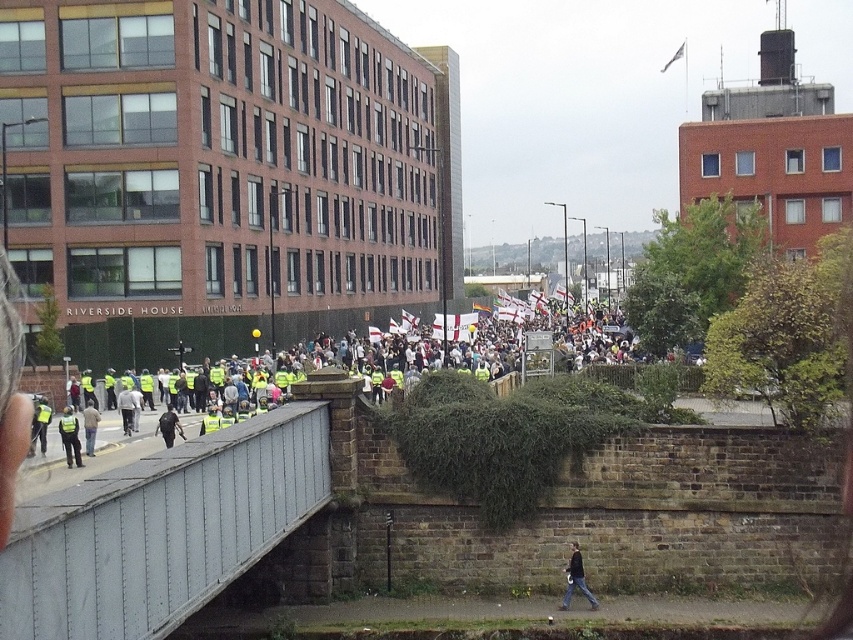
You are standing at the point labeled point (68, 451) and want to move towards the point labeled point (180, 422). Given that both points are on the same path, which direction should you move relative to your current position?

Since point (68, 451) is closer to the viewer than point (180, 422), you should move forward towards the point labeled point (180, 422) to reach it.

Looking at this image, you are a photographer trying to capture the crowd in the scene. You notice a light brown leather jacket at lower left and a yellow reflective vest at center. Which clothing item has a greater width when viewed from your position?

The light brown leather jacket at lower left has a greater width than the yellow reflective vest at center.